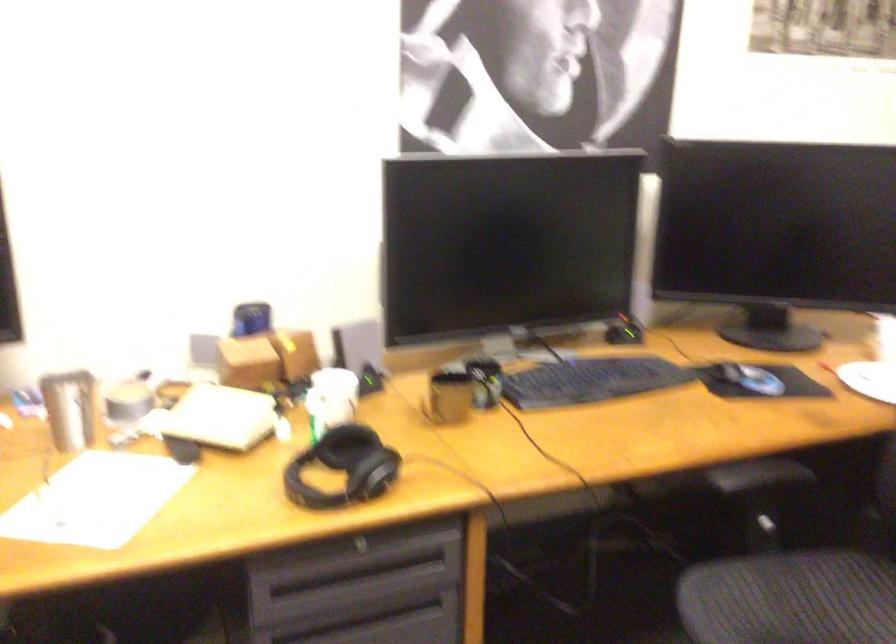
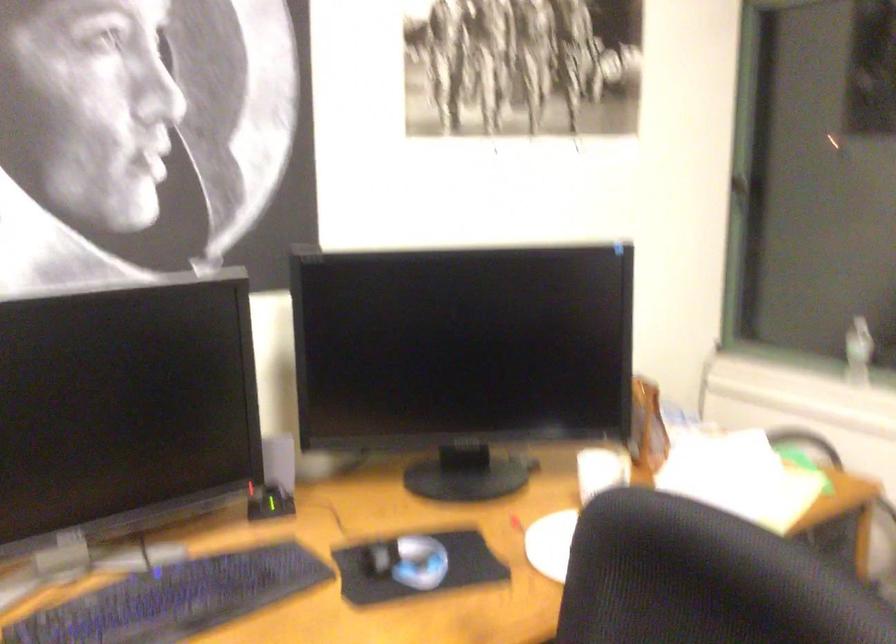
In a continuous first-person perspective shot, in which direction is the camera moving?

The cameraman moved toward right, forward.